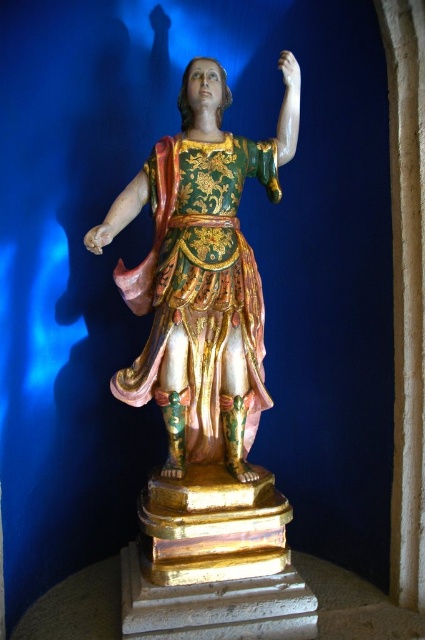
You are an art conservator examining the statue. You need to clean the gilded wood statue at center and the gold textured fabric robe at center. Which object should you start with if you want to work from the bottom up?

The gilded wood statue at center is located below the gold textured fabric robe at center, so you should start cleaning the gilded wood statue at center first.

From the picture: You are an art conservator examining the statue from the front. You notice two points on the statue marked at coordinates point (265, 532) and point (215, 376). Which of these points is closer to your viewpoint?

Point (265, 532) is closer to the camera than point (215, 376).

You are standing 5 feet away from the statue. If you want to touch the point at coordinates point (170, 256) on the statue, will you need to move closer?

The distance of point (170, 256) from viewer is 3.98 feet. Since you are currently 5 feet away, you need to move approximately 1.02 feet closer to reach it.